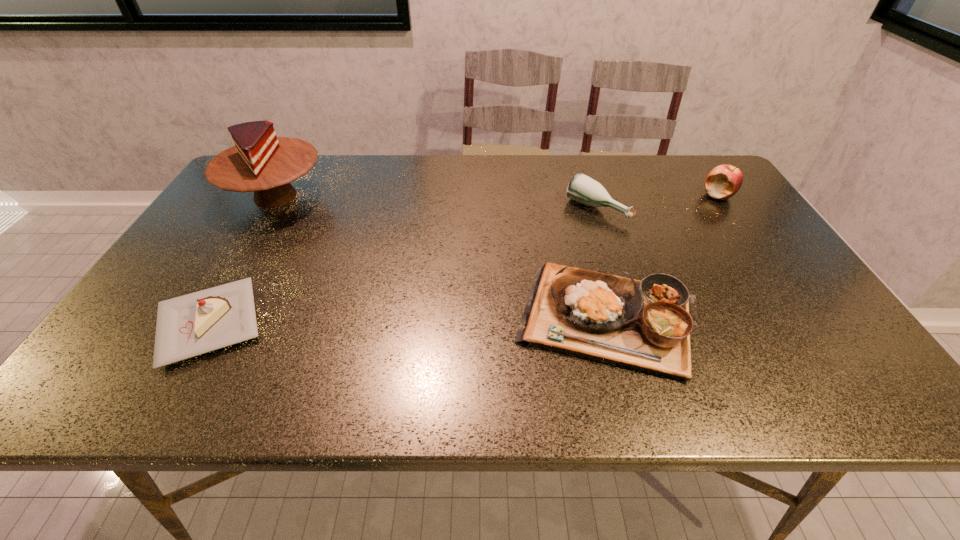
This screenshot has height=540, width=960. What are the coordinates of `free spot between the bottle and the platter` in the screenshot? It's located at click(603, 264).

Image resolution: width=960 pixels, height=540 pixels. I want to click on vacant area between the platter and the shortest object, so click(x=410, y=321).

Where is `free space between the apple and the platter`? free space between the apple and the platter is located at coordinates (664, 257).

The image size is (960, 540). What are the coordinates of `empty space between the taller cake and the platter` in the screenshot? It's located at [443, 258].

You are a GUI agent. You are given a task and a screenshot of the screen. Output one action in this format:
    pyautogui.click(x=<x>, y=<y>)
    Task: Click on the free space between the bottle and the platter
    
    Given the screenshot: What is the action you would take?
    603,264

Find the location of a particular element. Image resolution: width=960 pixels, height=540 pixels. the closest object relative to the apple is located at coordinates (582, 188).

What are the coordinates of `object that is the second nearest to the platter` in the screenshot? It's located at (724, 181).

Find the location of a particular element. The height and width of the screenshot is (540, 960). vacant space that satisfies the following two spatial constraints: 1. on the front side of the nearer cake; 2. on the right side of the farther cake is located at coordinates (201, 323).

In order to click on vacant space that satisfies the following two spatial constraints: 1. on the back side of the rightmost object; 2. on the right side of the platter in this screenshot , I will do `click(576, 195)`.

Find the location of `blank space that satisfies the following two spatial constraints: 1. on the front side of the platter; 2. on the left side of the tallest object`. blank space that satisfies the following two spatial constraints: 1. on the front side of the platter; 2. on the left side of the tallest object is located at coordinates (203, 319).